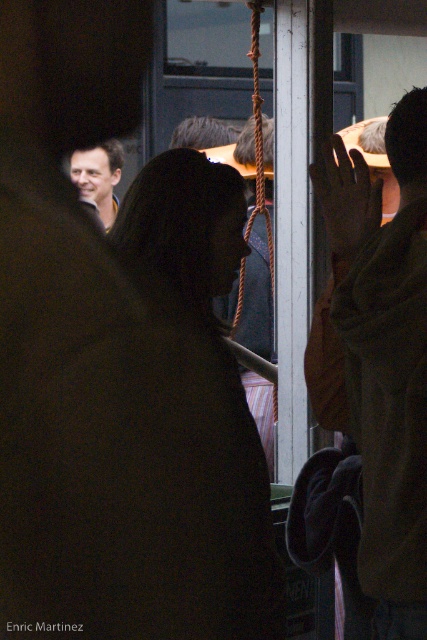
Which of these two, black matte coat at center or matte black jacket at upper left, stands taller?

black matte coat at center is taller.

Describe the element at coordinates (195, 410) in the screenshot. The width and height of the screenshot is (427, 640). I see `black matte coat at center` at that location.

Which is in front, point (195, 253) or point (108, 179)?

Positioned in front is point (195, 253).

Where is `black matte coat at center`? Image resolution: width=427 pixels, height=640 pixels. black matte coat at center is located at coordinates (195, 410).

Is brown fuzzy jacket at right thinner than matte black jacket at upper left?

No.

Can you confirm if brown fuzzy jacket at right is taller than matte black jacket at upper left?

Correct, brown fuzzy jacket at right is much taller as matte black jacket at upper left.

What do you see at coordinates (385, 356) in the screenshot? This screenshot has width=427, height=640. I see `brown fuzzy jacket at right` at bounding box center [385, 356].

The width and height of the screenshot is (427, 640). I want to click on brown fuzzy jacket at right, so click(x=385, y=356).

Can you confirm if black matte coat at center is positioned above brown fuzzy jacket at right?

Actually, black matte coat at center is below brown fuzzy jacket at right.

Consider the image. Is black matte coat at center taller than brown fuzzy jacket at right?

In fact, black matte coat at center may be shorter than brown fuzzy jacket at right.

Is point (195, 548) farther from viewer compared to point (379, 545)?

No, (195, 548) is closer to viewer.

You are a GUI agent. You are given a task and a screenshot of the screen. Output one action in this format:
    pyautogui.click(x=<x>, y=<y>)
    Task: Click on the black matte coat at center
    
    Given the screenshot: What is the action you would take?
    pyautogui.click(x=195, y=410)